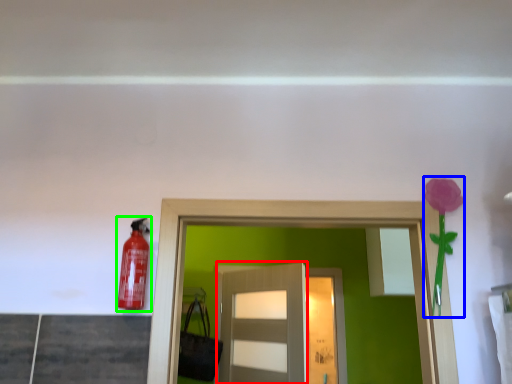
Question: Considering the real-world distances, which object is farthest from door (highlighted by a red box)? flower (highlighted by a blue box) or extinguisher (highlighted by a green box)?

Choices:
 (A) flower
 (B) extinguisher

Answer: (B)